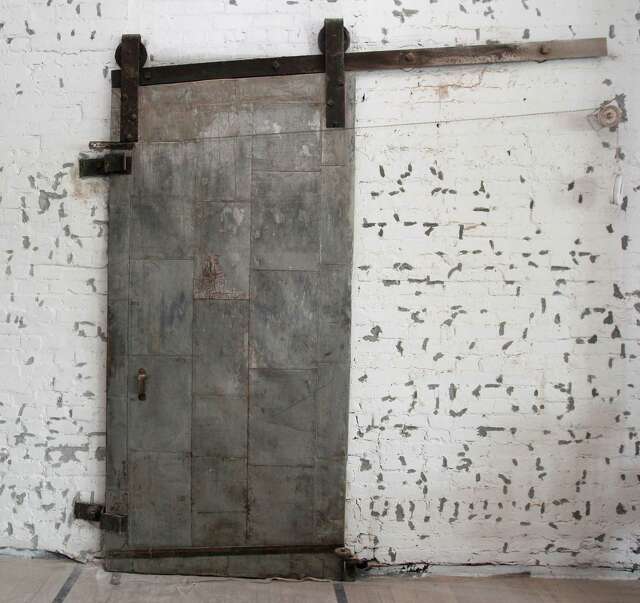
At what (x,y) coordinates should I click in order to perform the action: click on iron hinges. Please return your answer as a coordinate pair (x, y). Image resolution: width=640 pixels, height=603 pixels. Looking at the image, I should click on (118, 160), (109, 515).